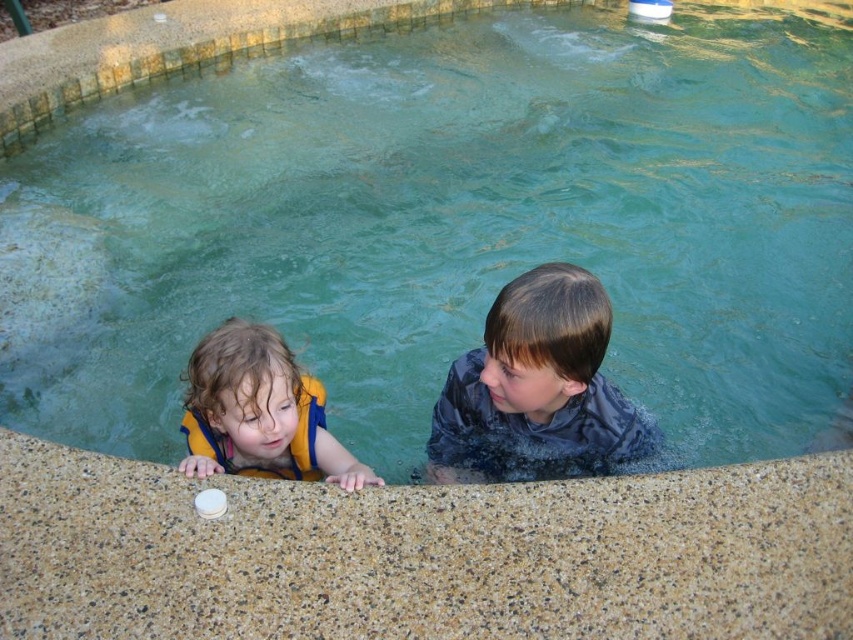
You are a lifeguard and need to retrieve an object from the pool. The dark blue wet shirt at upper center and the yellow life jacket at left are both in the water. If you can only reach one object without moving, which one is closer to your current position?

The dark blue wet shirt at upper center and yellow life jacket at left are 34.02 inches apart, so the closer one depends on your position. However, since the question states you can only reach one without moving, the answer cannot be determined without knowing your exact location relative to both objects.

You are a lifeguard at the pool and need to determine which clothing item is larger between the dark blue wet shirt at upper center and the yellow life vest at left. Which one should you point out?

The dark blue wet shirt at upper center is bigger than the yellow life vest at left, so you should point out the dark blue wet shirt at upper center.

You are a lifeguard at the pool and need to ensure all children are wearing properly sized life vests. You notice two children in the pool. The child on the left is wearing the yellow life vest at left, and the child on the right is wearing the yellow life jacket at left. Which one is more likely to be properly fitted?

The yellow life vest at left has a larger size compared to the yellow life jacket at left, so the child wearing the yellow life vest at left is more likely to be properly fitted if they require a larger size for safety.